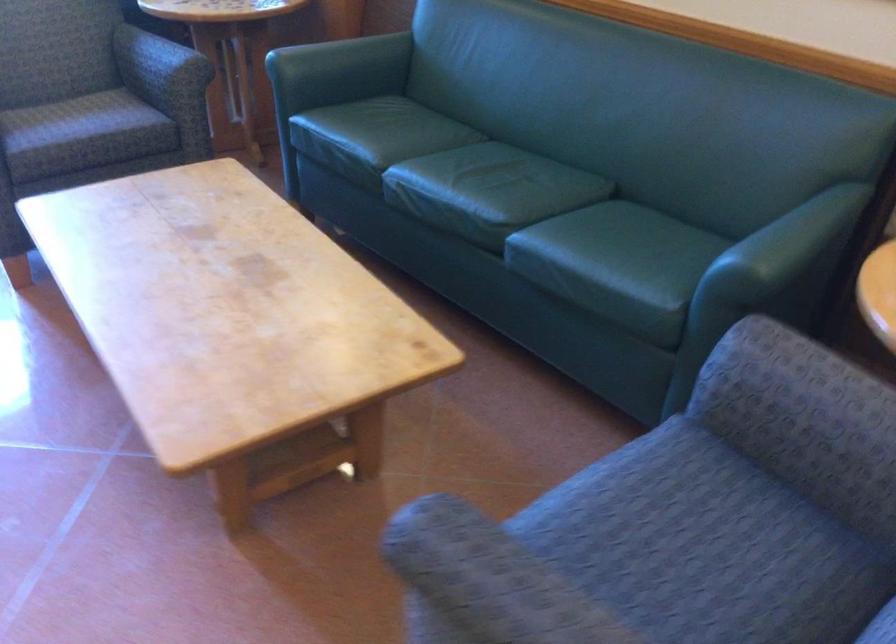
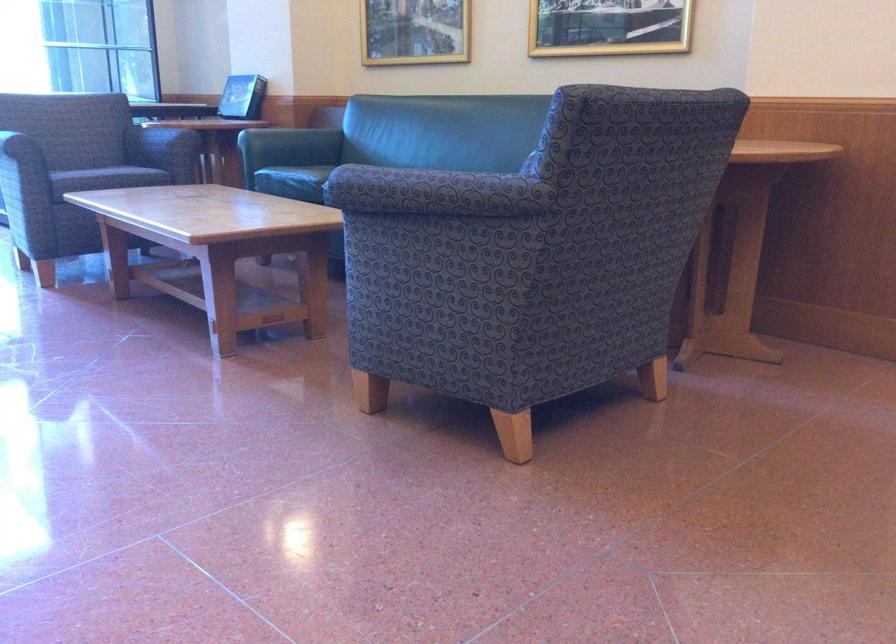
In the second image, find the point that corresponds to pixel 346 75 in the first image.

(290, 145)